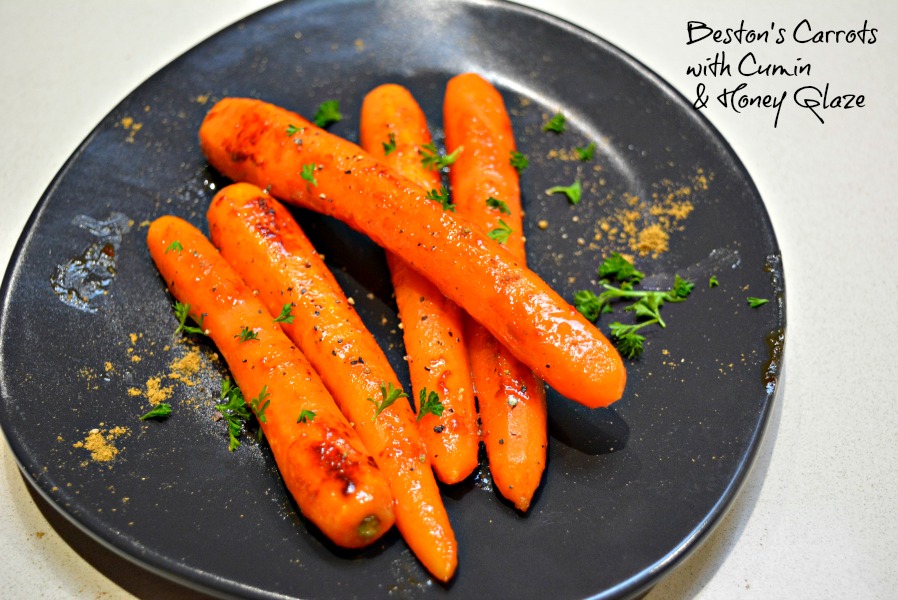
Image resolution: width=898 pixels, height=600 pixels. I want to click on black plate, so click(618, 545).